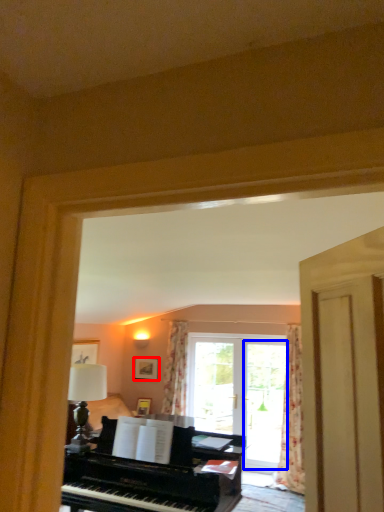
Question: Among these objects, which one is nearest to the camera, picture frame (highlighted by a red box) or screen door (highlighted by a blue box)?

Choices:
 (A) picture frame
 (B) screen door

Answer: (B)